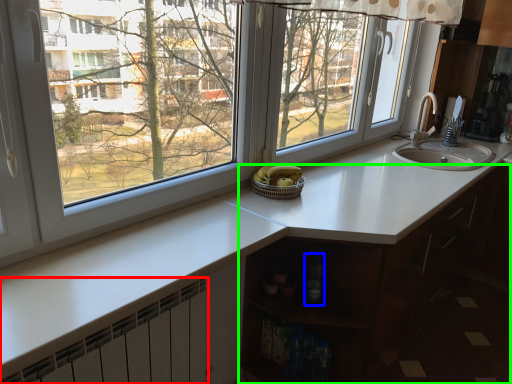
Question: Which is farther away from radiator (highlighted by a red box)? bottle (highlighted by a blue box) or cabinetry (highlighted by a green box)?

Choices:
 (A) bottle
 (B) cabinetry

Answer: (B)